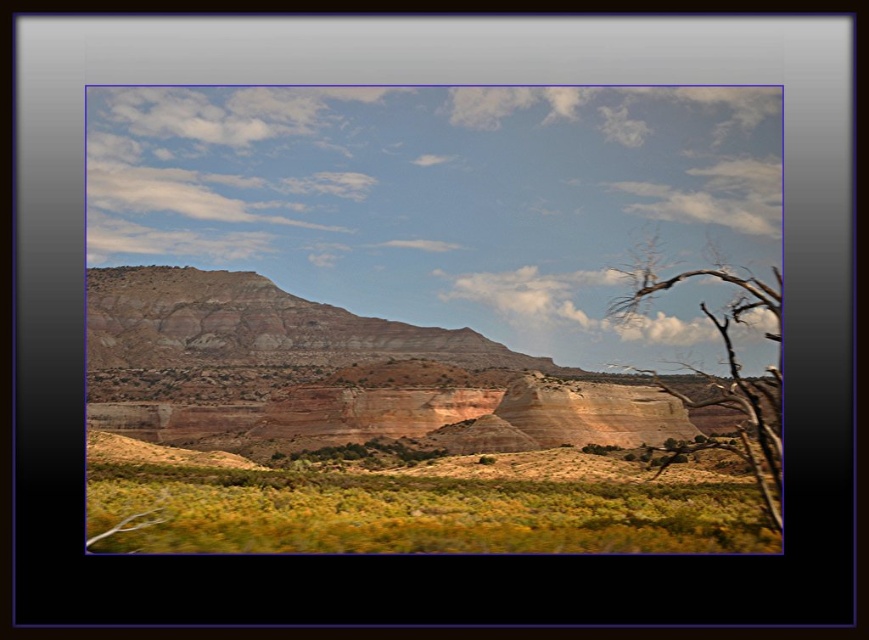
You are a hiker who wants to take a photo of the rustic sandstone cliffs at center and the brown dry wood at right. Which object should you focus on first if you want to capture both in one frame without moving your camera?

You should focus on the brown dry wood at right first because it is taller than the rustic sandstone cliffs at center, so adjusting focus from the taller object to the shorter one ensures both are in the frame.

You are a hiker trying to navigate through the area. You need to reach a landmark behind the brown dry wood at right. To avoid getting too close to the cliff edge, you decide to walk around the green shrubbery at lower center. Which direction should you go to stay as far from the cliff as possible?

To stay as far from the cliff as possible, you should go around the green shrubbery at lower center in the direction away from the brown dry wood at right since the green shrubbery at lower center is closer to the viewer than the brown dry wood at right, meaning the area behind the green shrubbery is farther from the cliff edge.

You are a hiker who wants to take a photo of the brown dry wood at right without the green shrubbery at lower center appearing in the frame. Is it possible to position yourself in a way that achieves this?

The green shrubbery at lower center is located below the brown dry wood at right. Since the shrubbery is below the wood, you can position yourself higher up so that the shrubbery is out of the frame while still capturing the brown dry wood at right.